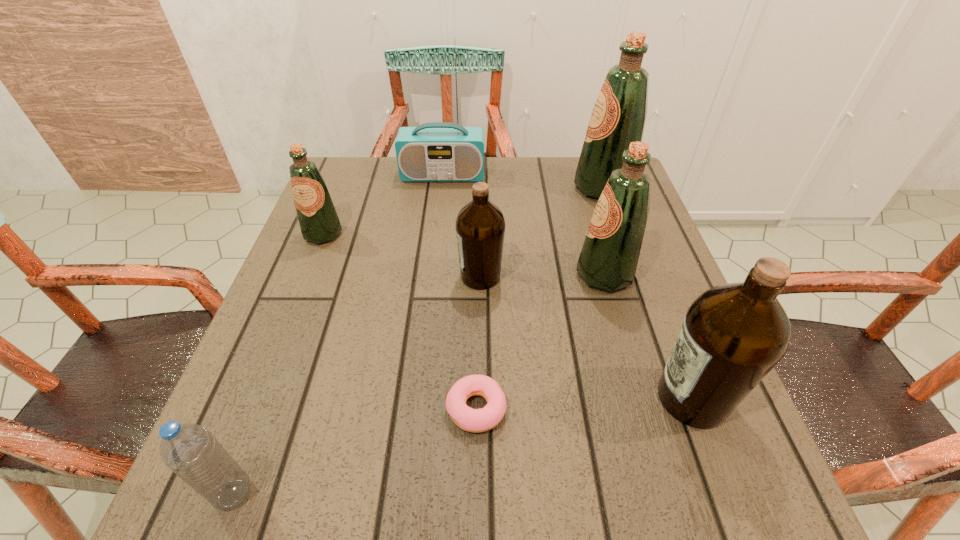
What are the coordinates of `vacant space located 0.240m on the front-facing side of the second smallest green olive oil` in the screenshot? It's located at (463, 274).

Identify the location of free region located on the label of the nearer brown olive oil. (564, 397).

Locate an element on the screen. free space located on the label of the nearer brown olive oil is located at coordinates (444, 397).

Locate an element on the screen. vacant area located 0.240m on the label of the nearer brown olive oil is located at coordinates (510, 397).

Where is `vacant area situated on the label of the left brown olive oil`? This screenshot has width=960, height=540. vacant area situated on the label of the left brown olive oil is located at coordinates (420, 276).

You are a GUI agent. You are given a task and a screenshot of the screen. Output one action in this format:
    pyautogui.click(x=<x>, y=<y>)
    Task: Click on the vacant space positioned on the label of the left brown olive oil
    This screenshot has width=960, height=540.
    Given the screenshot: What is the action you would take?
    pyautogui.click(x=392, y=276)

This screenshot has height=540, width=960. What are the coordinates of `free region located 0.110m on the label of the left brown olive oil` in the screenshot? It's located at tap(406, 276).

The height and width of the screenshot is (540, 960). In order to click on free spot located 0.120m on the front-facing side of the fourth nearest olive oil in this screenshot , I will do `click(303, 285)`.

This screenshot has height=540, width=960. In order to click on blank space located on the back of the water bottle in this screenshot , I will do `click(276, 379)`.

This screenshot has height=540, width=960. Find the location of `free space located 0.320m on the left of the pink doughnut`. free space located 0.320m on the left of the pink doughnut is located at coordinates (250, 409).